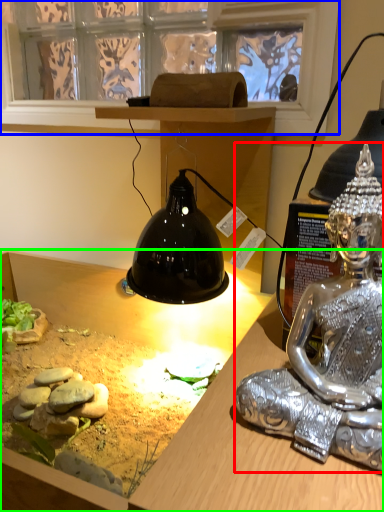
Question: Based on their relative distances, which object is nearer to person (highlighted by a red box)? Choose from window screen (highlighted by a blue box) and desk (highlighted by a green box).

Choices:
 (A) window screen
 (B) desk

Answer: (B)